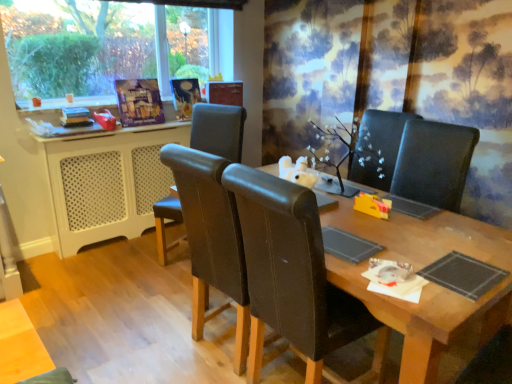
Identify the location of free spot in front of white perforated plastic at left. The width and height of the screenshot is (512, 384). (108, 277).